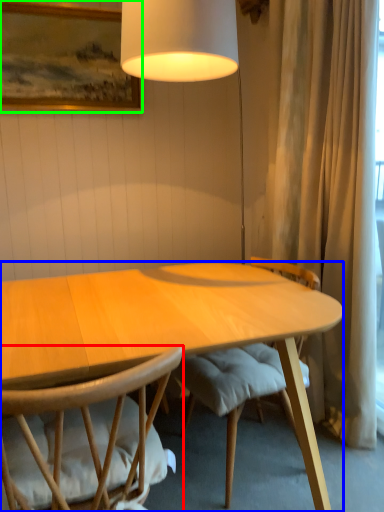
Question: Which object is the farthest from chair (highlighted by a red box)? Choose among these: desk (highlighted by a blue box) or picture frame (highlighted by a green box).

Choices:
 (A) desk
 (B) picture frame

Answer: (B)